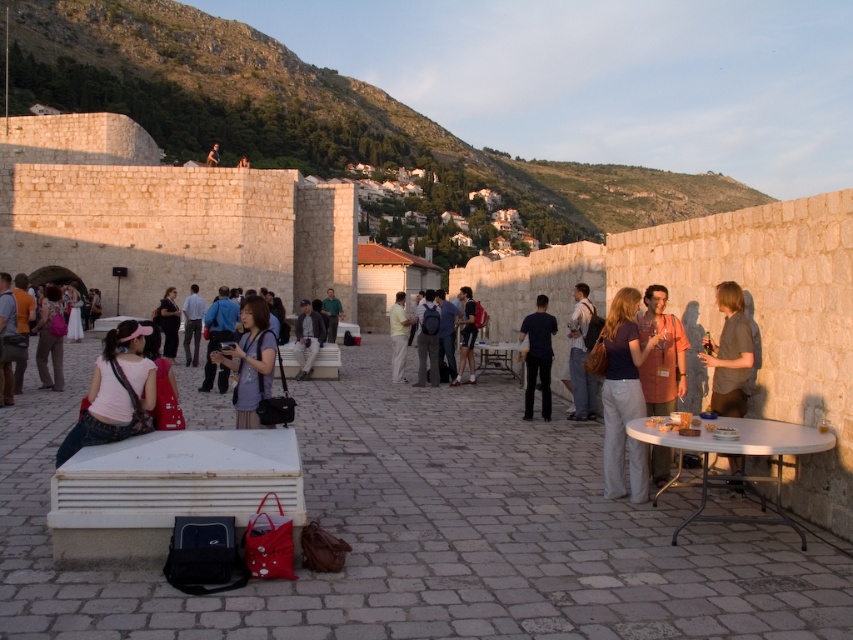
Can you confirm if matte purple shirt at center is taller than orange fabric shirt at center?

Indeed, matte purple shirt at center has a greater height compared to orange fabric shirt at center.

Who is more forward, (630,380) or (651,308)?

Point (630,380) is in front.

This screenshot has height=640, width=853. I want to click on matte purple shirt at center, so click(624, 396).

Which is behind, point (302, 376) or point (332, 292)?

Point (332, 292)

Does denim jacket at center have a lesser height compared to green fabric shirt at center?

Indeed, denim jacket at center has a lesser height compared to green fabric shirt at center.

This screenshot has height=640, width=853. Identify the location of denim jacket at center. (306, 339).

Is dark blue shirt at center bigger than light yellow shirt at center?

No, dark blue shirt at center is not bigger than light yellow shirt at center.

Does dark blue shirt at center appear under light yellow shirt at center?

Yes, dark blue shirt at center is below light yellow shirt at center.

Between point (524, 397) and point (392, 376), which one is positioned behind?

Positioned behind is point (392, 376).

Where is `dark blue shirt at center`? dark blue shirt at center is located at coordinates (538, 356).